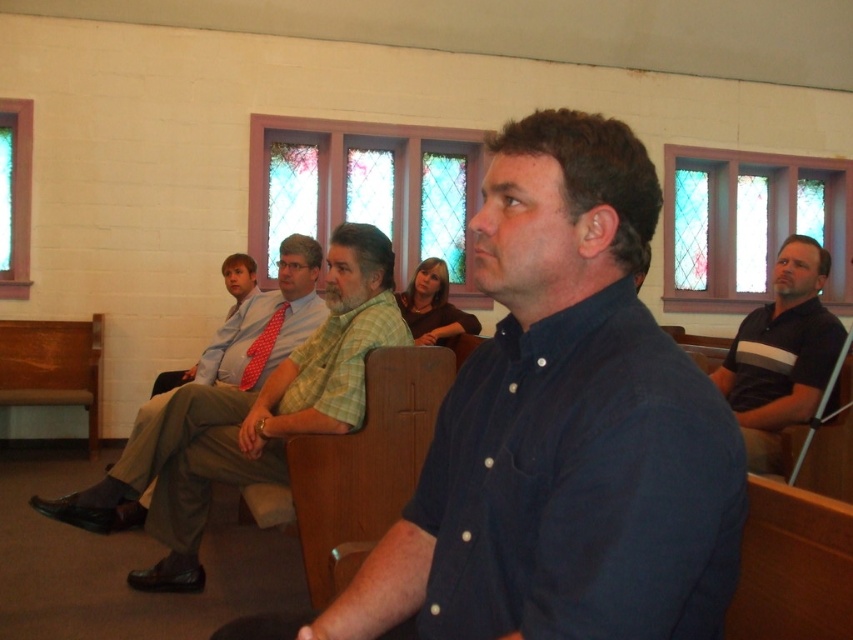
Question: Which of the following is the farthest from the observer?

Choices:
 (A) dark blue button-up shirt at center
 (B) matte red tie at center
 (C) light blue shirt at center
 (D) black striped polo shirt at right

Answer: (B)

Question: Considering the relative positions of light blue shirt at center and black striped polo shirt at right in the image provided, where is light blue shirt at center located with respect to black striped polo shirt at right?

Choices:
 (A) right
 (B) left

Answer: (B)

Question: Can you confirm if light blue shirt at center is positioned above matte red tie at center?

Choices:
 (A) no
 (B) yes

Answer: (A)

Question: Estimate the real-world distances between objects in this image. Which object is closer to the dark blue button-up shirt at center?

Choices:
 (A) green plaid shirt at center
 (B) black striped polo shirt at right

Answer: (A)

Question: Which object is closer to the camera taking this photo?

Choices:
 (A) black striped polo shirt at right
 (B) matte red tie at center

Answer: (A)

Question: Considering the relative positions of green plaid shirt at center and matte red tie at center in the image provided, where is green plaid shirt at center located with respect to matte red tie at center?

Choices:
 (A) right
 (B) left

Answer: (A)